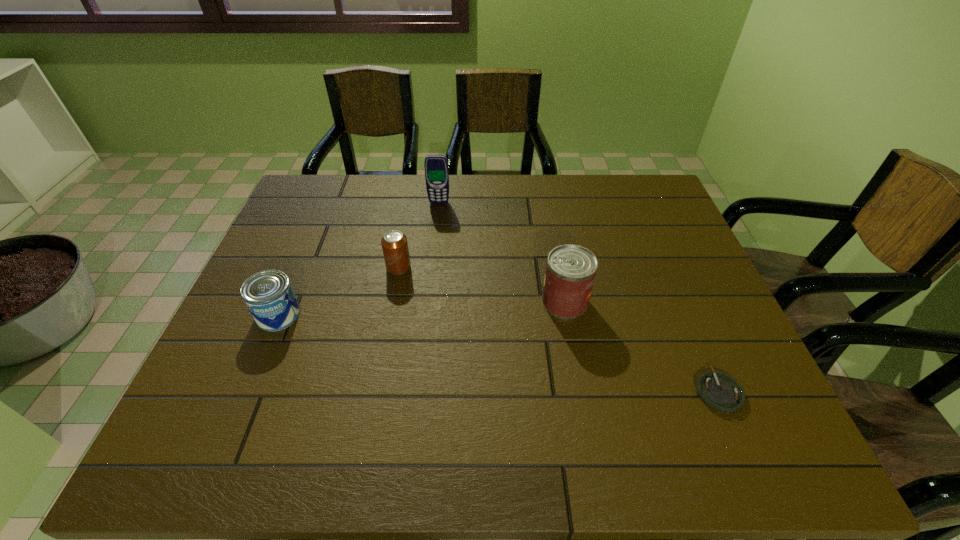
The image size is (960, 540). Find the location of `cellular telephone`. cellular telephone is located at coordinates (436, 166).

Where is `the tallest object`? the tallest object is located at coordinates (436, 166).

Identify the location of the rightmost can. (570, 272).

Where is `the second object from right to left`? The height and width of the screenshot is (540, 960). the second object from right to left is located at coordinates (570, 272).

Where is `the fourth object from right to left`? the fourth object from right to left is located at coordinates (394, 243).

This screenshot has width=960, height=540. What are the coordinates of `the fourth nearest object` in the screenshot? It's located at (394, 243).

At what (x,y) coordinates should I click in order to perform the action: click on the leftmost can. Please return your answer as a coordinate pair (x, y). This screenshot has height=540, width=960. Looking at the image, I should click on (268, 295).

You are a GUI agent. You are given a task and a screenshot of the screen. Output one action in this format:
    pyautogui.click(x=<x>, y=<y>)
    Task: Click on the ashtray
    
    Given the screenshot: What is the action you would take?
    pyautogui.click(x=719, y=391)

At what (x,y) coordinates should I click in order to perform the action: click on the nearest object. Please return your answer as a coordinate pair (x, y). Looking at the image, I should click on (719, 391).

I want to click on vacant space located 0.390m on the front-facing side of the cellular telephone, so click(429, 294).